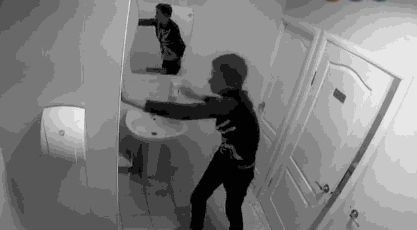
In order to click on faucet in this screenshot , I will do [x=152, y=107].